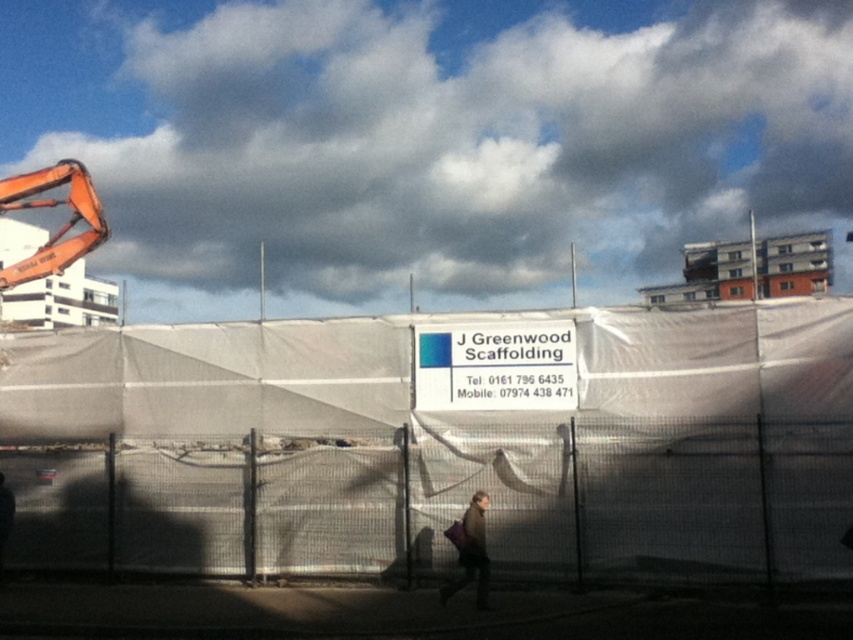
Can you confirm if white plastic sign at center is positioned to the right of brown leather jacket at center?

Correct, you'll find white plastic sign at center to the right of brown leather jacket at center.

Who is taller, white plastic sign at center or brown leather jacket at center?

brown leather jacket at center

Measure the distance between point (x=461, y=397) and camera.

They are 15.80 meters apart.

Find the location of a particular element. white plastic sign at center is located at coordinates (495, 365).

How distant is metallic wire mesh fence at center from brown leather jacket at center?

The distance of metallic wire mesh fence at center from brown leather jacket at center is 7.16 feet.

Is metallic wire mesh fence at center smaller than brown leather jacket at center?

No, metallic wire mesh fence at center is not smaller than brown leather jacket at center.

The width and height of the screenshot is (853, 640). What do you see at coordinates (448, 504) in the screenshot?
I see `metallic wire mesh fence at center` at bounding box center [448, 504].

Image resolution: width=853 pixels, height=640 pixels. In order to click on metallic wire mesh fence at center in this screenshot , I will do `click(448, 504)`.

Is metallic wire mesh fence at center behind white plastic sign at center?

No.

Locate an element on the screen. metallic wire mesh fence at center is located at coordinates pos(448,504).

Where is `metallic wire mesh fence at center`? metallic wire mesh fence at center is located at coordinates point(448,504).